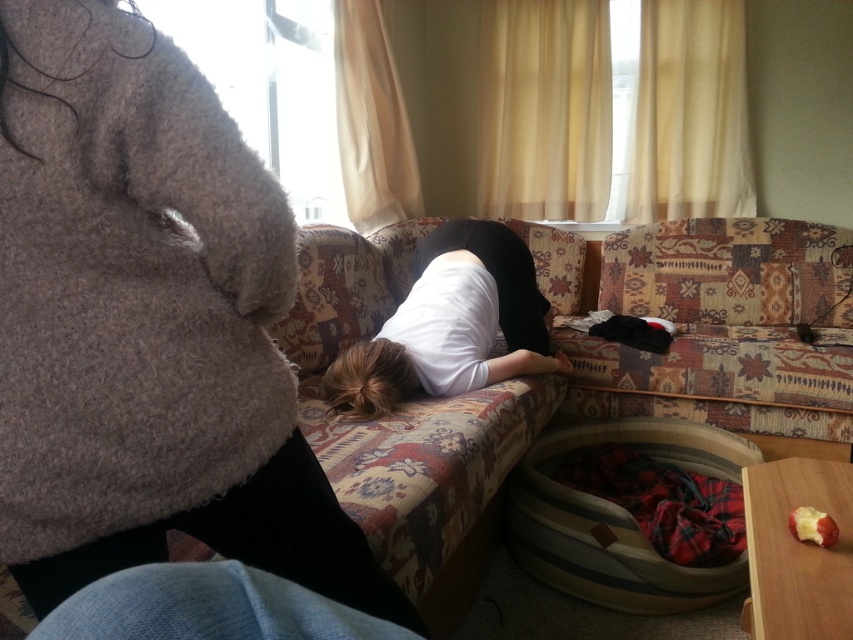
You are a photographer setting up a shoot in this room. You need to ensure that the fuzzy beige sweater at upper left and the white matte shirt at center are both visible in the frame. Based on their positions, which object is higher up in the image?

The fuzzy beige sweater at upper left is above the white matte shirt at center, so it is higher up in the image.

You are organizing a small party and need to place a decorative pillow between the fuzzy beige sweater at upper left and the wooden pet bed at lower right. Based on their positions, which object should the pillow be closer to?

The fuzzy beige sweater at upper left is positioned on the left side of the wooden pet bed at lower right, so the decorative pillow should be placed closer to the fuzzy beige sweater at upper left to maintain symmetry between the two objects.